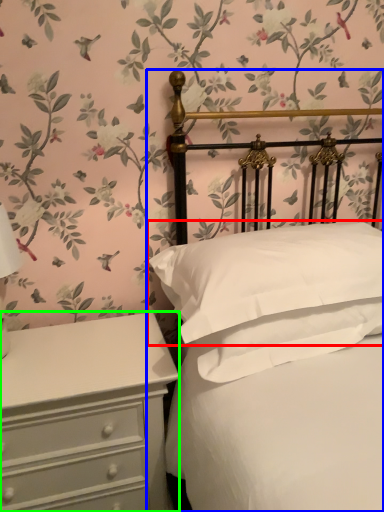
Question: Based on their relative distances, which object is nearer to pillow (highlighted by a red box)? Choose from bed (highlighted by a blue box) and chest of drawers (highlighted by a green box).

Choices:
 (A) bed
 (B) chest of drawers

Answer: (A)